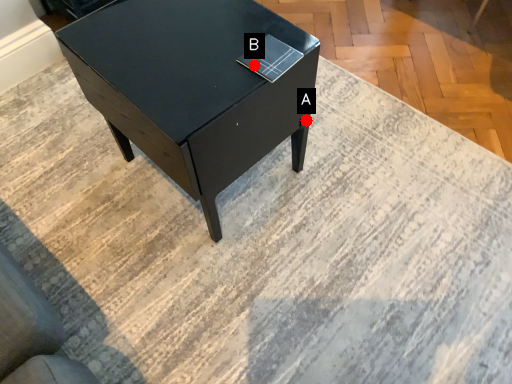
Question: Two points are circled on the image, labeled by A and B beside each circle. Which point appears farthest from the camera in this image?

Choices:
 (A) A is further
 (B) B is further

Answer: (A)